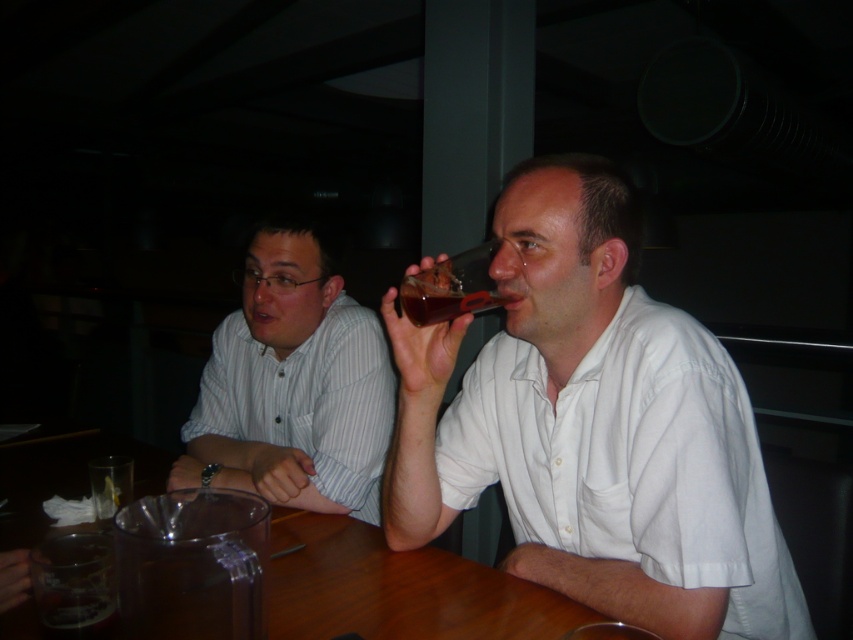
Question: Which point appears closest to the camera in this image?

Choices:
 (A) (345, 296)
 (B) (543, 419)

Answer: (B)

Question: Is the position of white cotton shirt at upper right more distant than that of translucent plastic cup at upper right?

Choices:
 (A) yes
 (B) no

Answer: (B)

Question: Does white cotton shirt at upper right appear on the left side of white striped shirt at left?

Choices:
 (A) yes
 (B) no

Answer: (B)

Question: Among these objects, which one is farthest from the camera?

Choices:
 (A) white striped shirt at left
 (B) translucent plastic cup at upper right
 (C) wooden table at center
 (D) white cotton shirt at upper right

Answer: (A)

Question: Does white cotton shirt at upper right come in front of white striped shirt at left?

Choices:
 (A) no
 (B) yes

Answer: (B)

Question: Which of these objects is positioned closest to the white striped shirt at left?

Choices:
 (A) white cotton shirt at upper right
 (B) translucent plastic cup at upper right

Answer: (A)